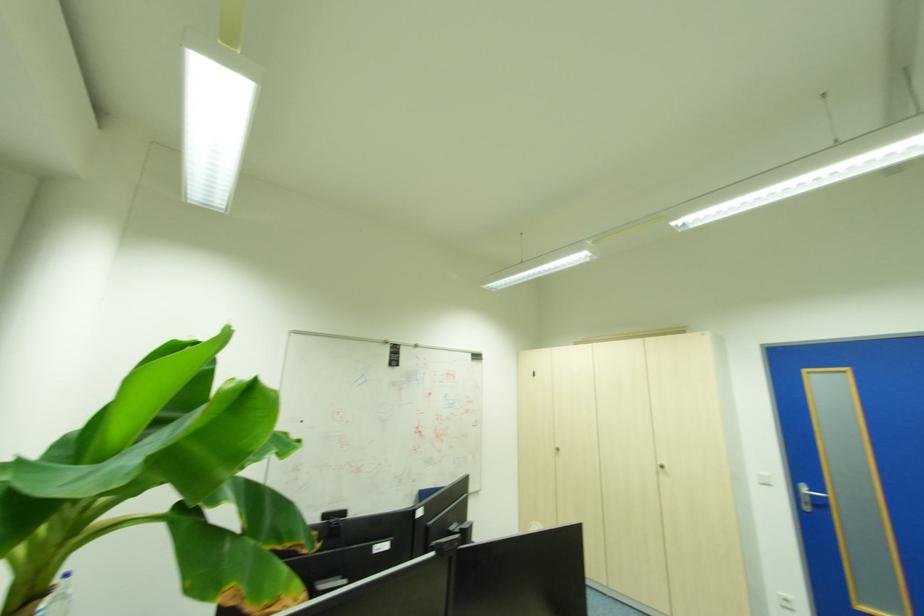
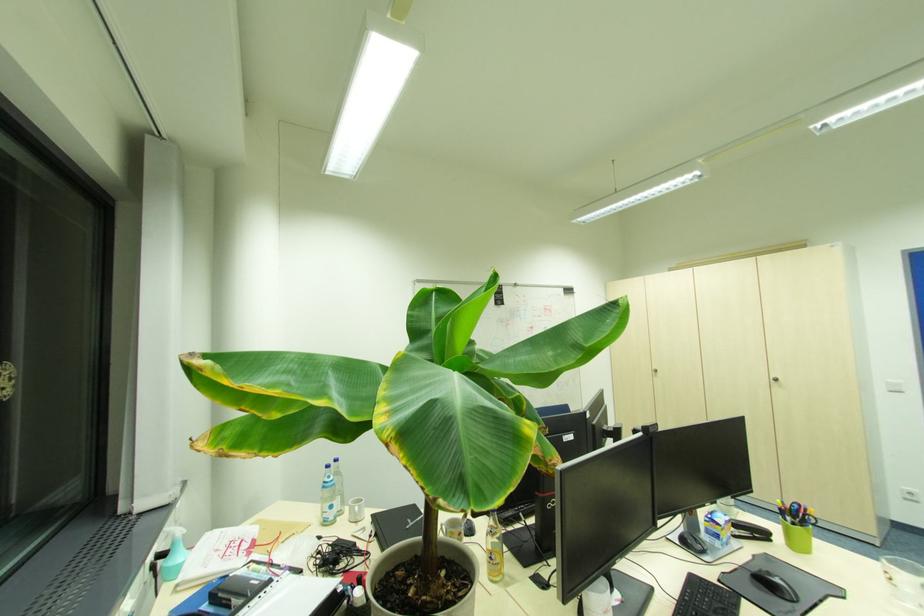
Question: The first image is from the beginning of the video and the second image is from the end. How did the camera likely rotate when shooting the video?

Choices:
 (A) Left
 (B) Right
 (C) Up
 (D) Down

Answer: (D)